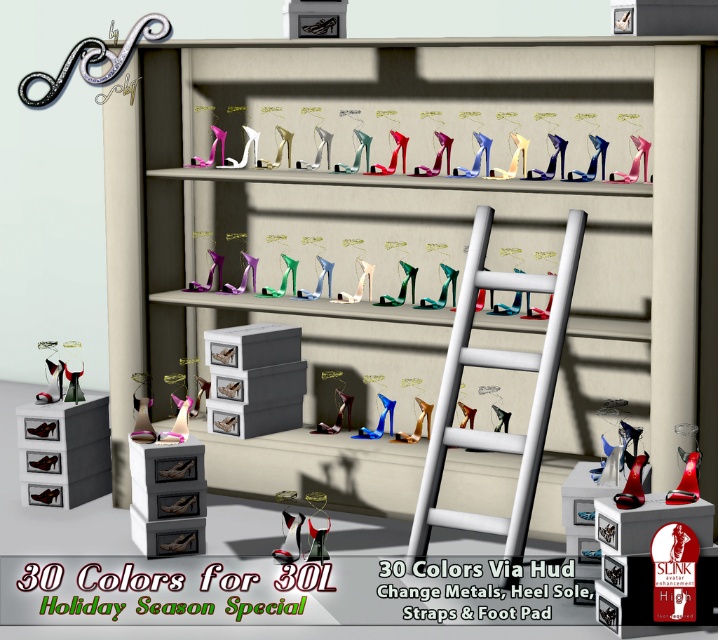
You are a customer in the store and want to pick up both items located at point (531, 285) and point (289, 557). Which item should you pick up first to minimize the distance you walk?

You should pick up the item at point (531, 285) first because it is closer to you than point (289, 557).